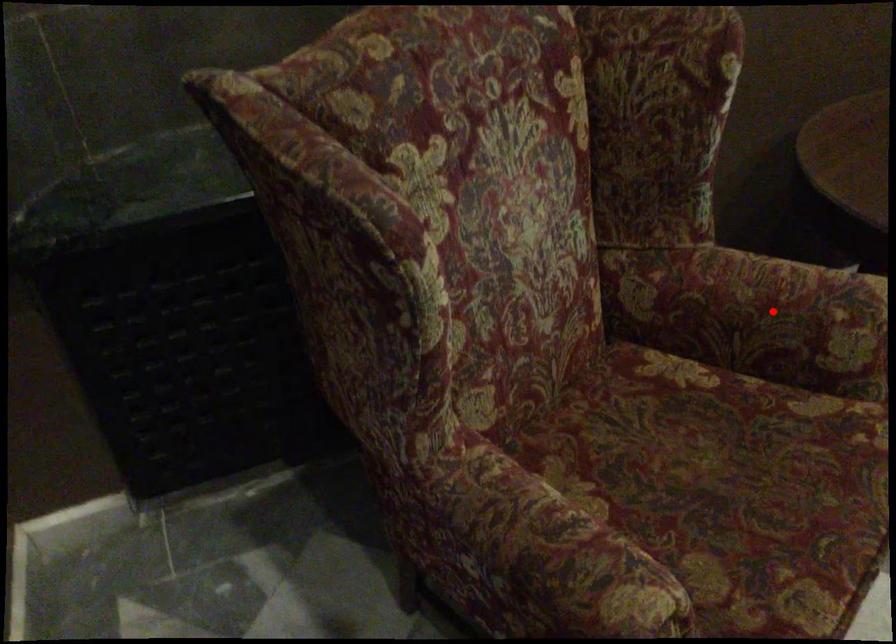
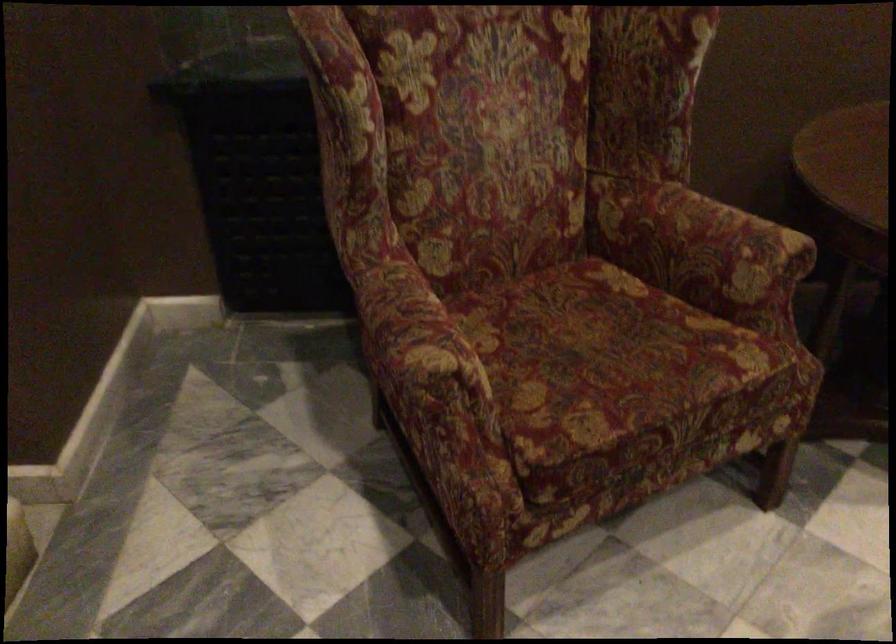
The point at the highlighted location is marked in the first image. Where is the corresponding point in the second image?

(700, 243)